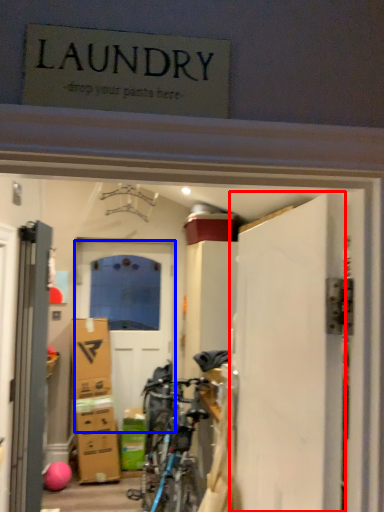
Question: Which object is closer to the camera taking this photo, door (highlighted by a red box) or door (highlighted by a blue box)?

Choices:
 (A) door
 (B) door

Answer: (A)